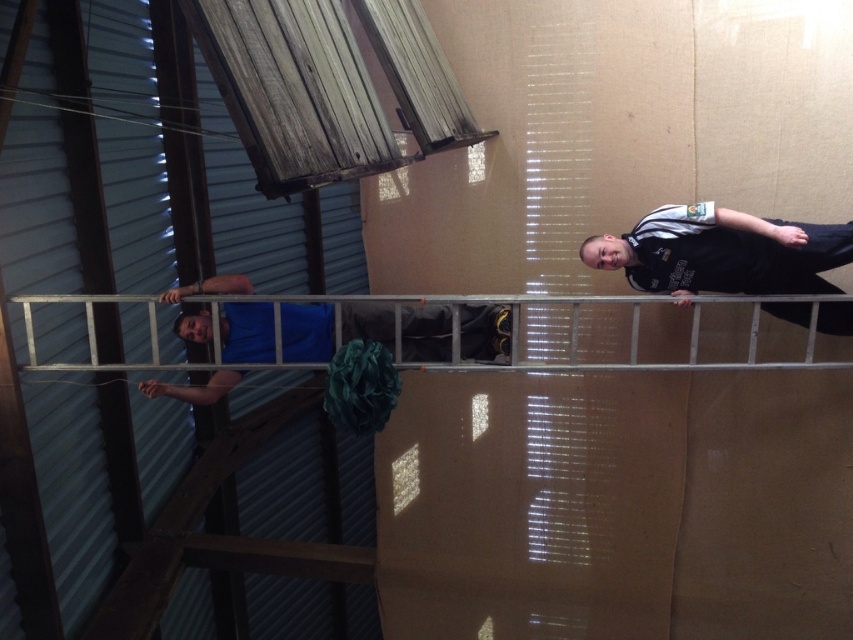
Who is positioned more to the right, black jersey at right or silver metallic ladder at center?

black jersey at right

The height and width of the screenshot is (640, 853). What do you see at coordinates (722, 252) in the screenshot?
I see `black jersey at right` at bounding box center [722, 252].

Find the location of a particular element. This screenshot has height=640, width=853. black jersey at right is located at coordinates (722, 252).

Can you confirm if blue fabric at center is positioned to the left of silver metallic ladder at center?

Indeed, blue fabric at center is positioned on the left side of silver metallic ladder at center.

Measure the distance between blue fabric at center and camera.

blue fabric at center and camera are 3.65 meters apart from each other.

Between point (229, 324) and point (706, 296), which one is positioned in front?

Point (706, 296)

Find the location of a particular element. blue fabric at center is located at coordinates (247, 332).

Which is above, black jersey at right or blue fabric at center?

black jersey at right is higher up.

Is point (744, 243) farther from viewer compared to point (183, 326)?

No.

Image resolution: width=853 pixels, height=640 pixels. What are the coordinates of `black jersey at right` in the screenshot? It's located at (722, 252).